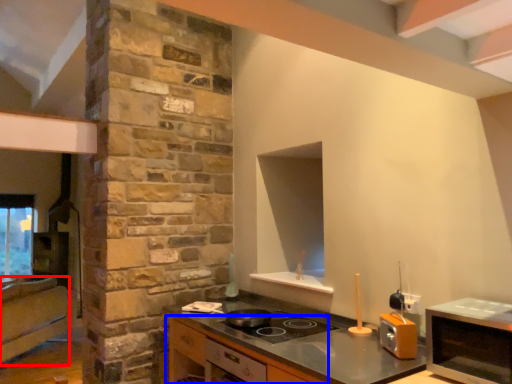
Question: Which of the following is the closest to the observer, cabinetry (highlighted by a red box) or cabinetry (highlighted by a blue box)?

Choices:
 (A) cabinetry
 (B) cabinetry

Answer: (B)